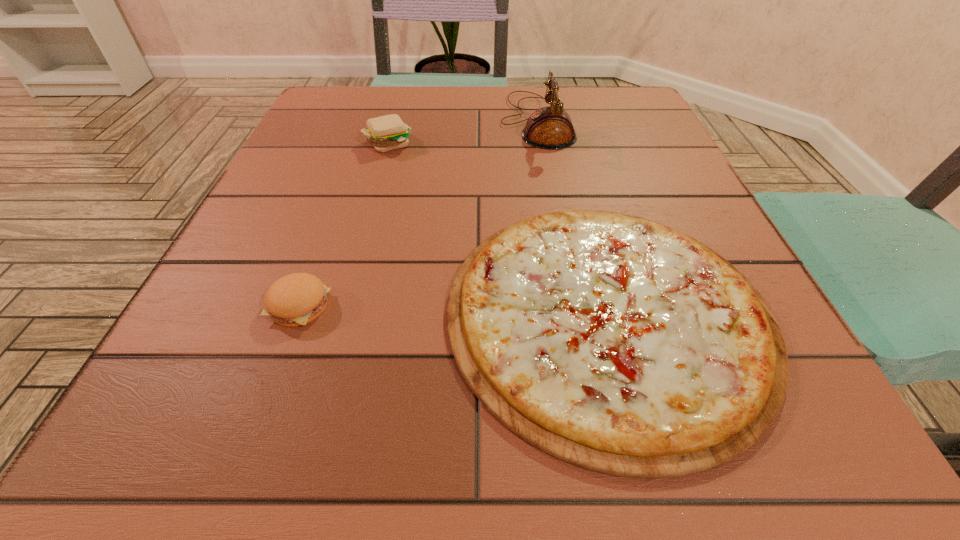
Locate an element on the screen. object that stands as the closest to the second shortest object is located at coordinates (617, 344).

This screenshot has width=960, height=540. In order to click on vacant space that satisfies the following two spatial constraints: 1. on the rotary dial of the tallest object; 2. on the front side of the taller patty in this screenshot , I will do `click(540, 143)`.

You are a GUI agent. You are given a task and a screenshot of the screen. Output one action in this format:
    pyautogui.click(x=<x>, y=<y>)
    Task: Click on the vacant space that satisfies the following two spatial constraints: 1. on the rotary dial of the tallest object; 2. on the front side of the shorter patty
    Image resolution: width=960 pixels, height=540 pixels.
    Given the screenshot: What is the action you would take?
    pyautogui.click(x=571, y=306)

At what (x,y) coordinates should I click in order to perform the action: click on vacant space that satisfies the following two spatial constraints: 1. on the rotary dial of the pizza; 2. on the left side of the telephone. Please return your answer as a coordinate pair (x, y). Image resolution: width=960 pixels, height=540 pixels. Looking at the image, I should click on (572, 314).

Where is `free space that satisfies the following two spatial constraints: 1. on the front side of the farther patty; 2. on the right side of the pizza`? free space that satisfies the following two spatial constraints: 1. on the front side of the farther patty; 2. on the right side of the pizza is located at coordinates (339, 314).

This screenshot has height=540, width=960. Find the location of `free space that satisfies the following two spatial constraints: 1. on the rotary dial of the tallest object; 2. on the left side of the pizza`. free space that satisfies the following two spatial constraints: 1. on the rotary dial of the tallest object; 2. on the left side of the pizza is located at coordinates (572, 314).